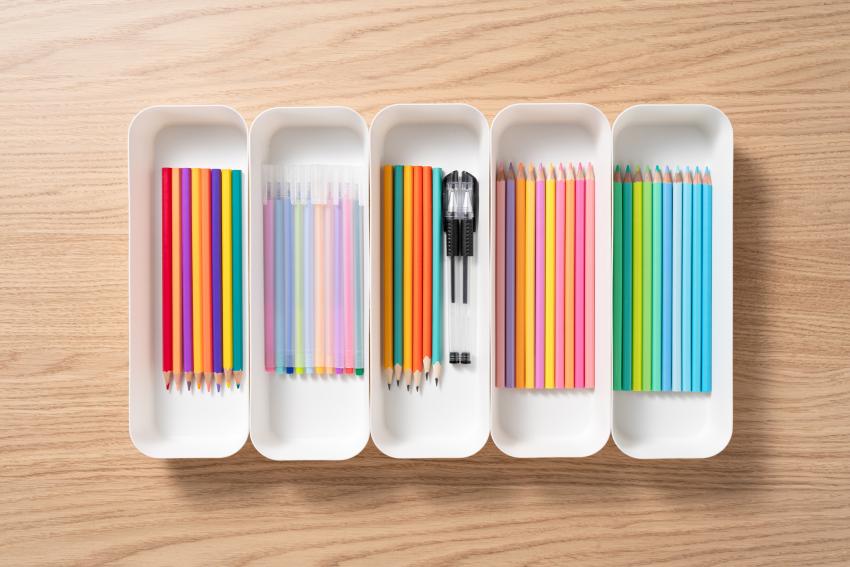
Where is `pencils in container on right`? pencils in container on right is located at coordinates click(706, 334), click(697, 323), click(684, 337), click(675, 336), click(665, 317), click(656, 308), click(647, 301), click(637, 300), click(626, 295), click(616, 296).